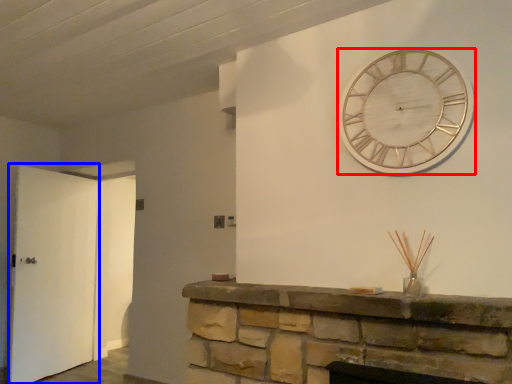
Question: Among these objects, which one is nearest to the camera, wall clock (highlighted by a red box) or door (highlighted by a blue box)?

Choices:
 (A) wall clock
 (B) door

Answer: (A)